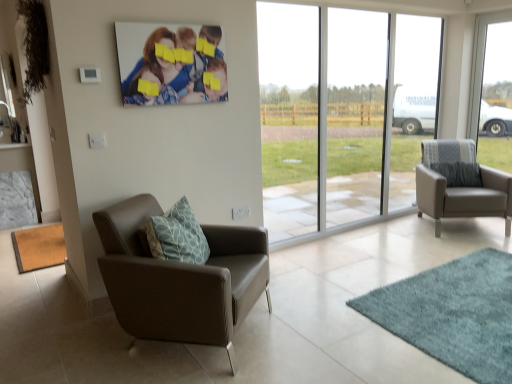
What do you see at coordinates (39, 247) in the screenshot? The image size is (512, 384). I see `brown matte mat at lower left, positioned as the first mat in back-to-front order` at bounding box center [39, 247].

Locate an element on the screen. brown leather chair at left, placed as the 1th chair when sorted from left to right is located at coordinates (180, 279).

The width and height of the screenshot is (512, 384). What do you see at coordinates (453, 314) in the screenshot?
I see `teal shaggy rug at lower right, which is the 2th mat in left-to-right order` at bounding box center [453, 314].

The image size is (512, 384). I want to click on matte gray armchair at right, the 2th chair from the front, so click(x=460, y=184).

Locate an element on the screen. white plastic power outlet at lower center is located at coordinates (240, 212).

Based on the photo, is matte canvas print at upper center at the back of teal shaggy rug at lower right, placed as the first mat when sorted from right to left?

No.

Consider the image. Considering the positions of objects teal shaggy rug at lower right, placed as the first mat when sorted from right to left, and matte canvas print at upper center in the image provided, who is more to the right, teal shaggy rug at lower right, placed as the first mat when sorted from right to left, or matte canvas print at upper center?

From the viewer's perspective, teal shaggy rug at lower right, placed as the first mat when sorted from right to left, appears more on the right side.

Is teal shaggy rug at lower right, placed as the first mat when sorted from right to left, shorter than matte canvas print at upper center?

Yes.

Is teal shaggy rug at lower right, acting as the 2th mat starting from the back, wider than matte canvas print at upper center?

Correct, the width of teal shaggy rug at lower right, acting as the 2th mat starting from the back, exceeds that of matte canvas print at upper center.

Is white plastic power outlet at lower center behind matte gray armchair at right, positioned as the 2th chair in left-to-right order?

No, white plastic power outlet at lower center is closer to the viewer.

Is white plastic power outlet at lower center shorter than matte gray armchair at right, the 1th chair from the back?

Correct, white plastic power outlet at lower center is not as tall as matte gray armchair at right, the 1th chair from the back.

Is white plastic power outlet at lower center in contact with matte gray armchair at right, positioned as the 2th chair in left-to-right order?

No, white plastic power outlet at lower center is not making contact with matte gray armchair at right, positioned as the 2th chair in left-to-right order.

From a real-world perspective, is white plastic power outlet at lower center positioned over matte gray armchair at right, positioned as the 2th chair in left-to-right order, based on gravity?

Yes, from a real-world perspective, white plastic power outlet at lower center is above matte gray armchair at right, positioned as the 2th chair in left-to-right order.

I want to click on power outlet above the teal shaggy rug at lower right, placed as the first mat when sorted from right to left (from the image's perspective), so pos(240,212).

From a real-world perspective, is teal shaggy rug at lower right, acting as the 2th mat starting from the back, beneath white plastic power outlet at lower center?

Indeed, from a real-world perspective, teal shaggy rug at lower right, acting as the 2th mat starting from the back, is positioned beneath white plastic power outlet at lower center.

Looking at this image, could you tell me if teal shaggy rug at lower right, placed as the first mat when sorted from right to left, is facing white plastic power outlet at lower center?

No, teal shaggy rug at lower right, placed as the first mat when sorted from right to left, is not aimed at white plastic power outlet at lower center.

Can white plastic power outlet at lower center be found inside teal shaggy rug at lower right, placed as the first mat when sorted from right to left?

Definitely not — white plastic power outlet at lower center is not inside teal shaggy rug at lower right, placed as the first mat when sorted from right to left.

Is brown matte mat at lower left, the second mat viewed from the right, bigger than brown leather chair at left, the 2th chair when ordered from right to left?

No, brown matte mat at lower left, the second mat viewed from the right, is not bigger than brown leather chair at left, the 2th chair when ordered from right to left.

Can you confirm if brown matte mat at lower left, the second mat viewed from the right, is shorter than brown leather chair at left, the second chair in the back-to-front sequence?

Yes.

Find the location of a particular element. The height and width of the screenshot is (384, 512). the 2nd mat behind the brown leather chair at left, the first chair positioned from the front, counting from the anchor's position is located at coordinates (39, 247).

Is white plastic power outlet at lower center next to transparent glass window at right, which is counted as the 1th window, starting from the right, and touching it?

No, white plastic power outlet at lower center is not making contact with transparent glass window at right, which is counted as the 1th window, starting from the right.

Do you think white plastic power outlet at lower center is within transparent glass window at right, which is counted as the 1th window, starting from the right, or outside of it?

white plastic power outlet at lower center is located beyond the bounds of transparent glass window at right, which is counted as the 1th window, starting from the right.

Is point (248, 210) positioned in front of point (507, 49)?

Yes, it is.

Is white plastic power outlet at lower center positioned before transparent glass window at right, the 2th window from the left?

Yes, white plastic power outlet at lower center is closer to the camera.

Does brown leather chair at left, the second chair in the back-to-front sequence, have a greater width compared to matte canvas print at upper center?

Indeed, brown leather chair at left, the second chair in the back-to-front sequence, has a greater width compared to matte canvas print at upper center.

Does point (211, 311) come in front of point (196, 66)?

Yes, point (211, 311) is closer to viewer.

Between brown leather chair at left, placed as the 1th chair when sorted from left to right, and matte canvas print at upper center, which one has less height?

matte canvas print at upper center is shorter.

Could you tell me if brown leather chair at left, placed as the 1th chair when sorted from left to right, is turned towards matte canvas print at upper center?

No, brown leather chair at left, placed as the 1th chair when sorted from left to right, is not oriented towards matte canvas print at upper center.

From the picture: Is transparent glass window at center, which is the second window in right-to-left order, turned away from teal shaggy rug at lower right, placed as the first mat when sorted from right to left?

No.

Between point (362, 119) and point (497, 294), which one is positioned in front?

The point (497, 294) is closer to the camera.

From the image's perspective, is transparent glass window at center, which appears as the first window when viewed from the left, located beneath teal shaggy rug at lower right, arranged as the first mat when viewed from the front?

Incorrect, from the image's perspective, transparent glass window at center, which appears as the first window when viewed from the left, is higher than teal shaggy rug at lower right, arranged as the first mat when viewed from the front.

Locate an element on the screen. The height and width of the screenshot is (384, 512). mat in front of the matte canvas print at upper center is located at coordinates (453, 314).

Locate an element on the screen. chair located on the right of white plastic power outlet at lower center is located at coordinates (460, 184).

Consider the image. Based on their spatial positions, is transparent glass window at right, which is counted as the 1th window, starting from the right, or brown leather chair at left, the first chair positioned from the front, closer to teal shaggy rug at lower right, arranged as the first mat when viewed from the front?

brown leather chair at left, the first chair positioned from the front.

Estimate the real-world distances between objects in this image. Which object is closer to teal shaggy rug at lower right, placed as the first mat when sorted from right to left, matte canvas print at upper center or transparent glass window at right, which is counted as the 1th window, starting from the right?

matte canvas print at upper center.

Which object lies further to the anchor point transparent glass window at right, which is counted as the 1th window, starting from the right, matte canvas print at upper center or white plastic power outlet at lower center?

matte canvas print at upper center lies further to transparent glass window at right, which is counted as the 1th window, starting from the right, than the other object.

Based on their spatial positions, is matte gray armchair at right, which appears as the 1th chair when viewed from the right, or transparent glass window at center, which appears as the first window when viewed from the left, closer to white plastic power outlet at lower center?

matte gray armchair at right, which appears as the 1th chair when viewed from the right.

When comparing their distances from transparent glass window at right, the 2th window from the left, does matte canvas print at upper center or matte gray armchair at right, the 2th chair from the front, seem further?

Among the two, matte canvas print at upper center is located further to transparent glass window at right, the 2th window from the left.

When comparing their distances from matte canvas print at upper center, does teal shaggy rug at lower right, acting as the 2th mat starting from the back, or transparent glass window at right, which is counted as the 1th window, starting from the right, seem further?

transparent glass window at right, which is counted as the 1th window, starting from the right, is further to matte canvas print at upper center.

From the image, which object appears to be farther from transparent glass window at right, which is counted as the 1th window, starting from the right, matte gray armchair at right, positioned as the 2th chair in left-to-right order, or brown matte mat at lower left, positioned as the first mat in back-to-front order?

brown matte mat at lower left, positioned as the first mat in back-to-front order, is further to transparent glass window at right, which is counted as the 1th window, starting from the right.

Based on their spatial positions, is transparent glass window at center, which is the second window in right-to-left order, or brown leather chair at left, the 2th chair when ordered from right to left, closer to transparent glass window at right, the 2th window from the left?

The object closer to transparent glass window at right, the 2th window from the left, is transparent glass window at center, which is the second window in right-to-left order.

The width and height of the screenshot is (512, 384). I want to click on mat between matte canvas print at upper center and matte gray armchair at right, the 1th chair from the back, in the horizontal direction, so (453, 314).

At what (x,y) coordinates should I click in order to perform the action: click on power outlet between brown leather chair at left, the first chair positioned from the front, and teal shaggy rug at lower right, acting as the 2th mat starting from the back, from left to right. Please return your answer as a coordinate pair (x, y). Looking at the image, I should click on (240, 212).

In order to click on mat between white plastic power outlet at lower center and transparent glass window at right, the 2th window from the left, in the horizontal direction in this screenshot , I will do `click(453, 314)`.

Where is `chair situated between brown leather chair at left, the first chair positioned from the front, and transparent glass window at right, which is counted as the 1th window, starting from the right, from left to right`? Image resolution: width=512 pixels, height=384 pixels. chair situated between brown leather chair at left, the first chair positioned from the front, and transparent glass window at right, which is counted as the 1th window, starting from the right, from left to right is located at coordinates (460, 184).